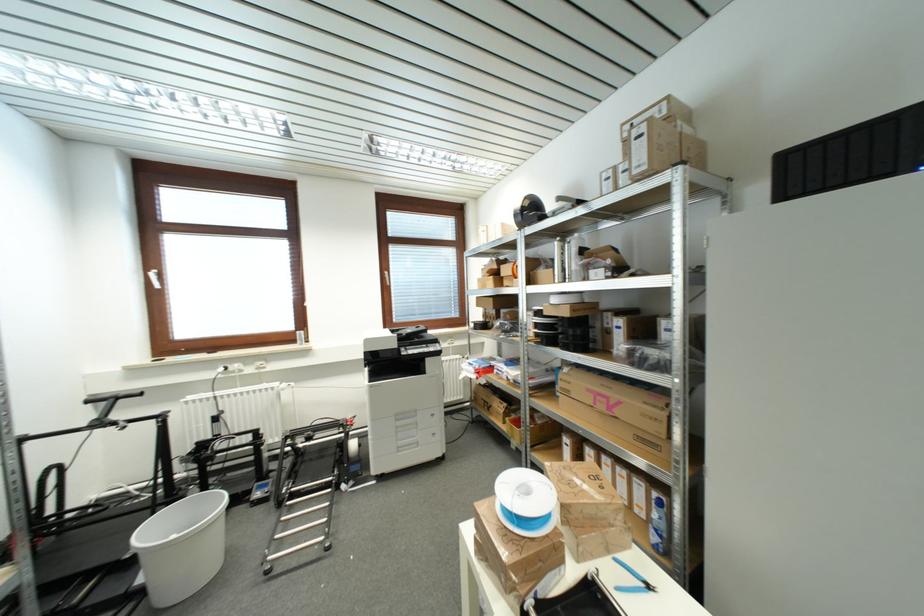
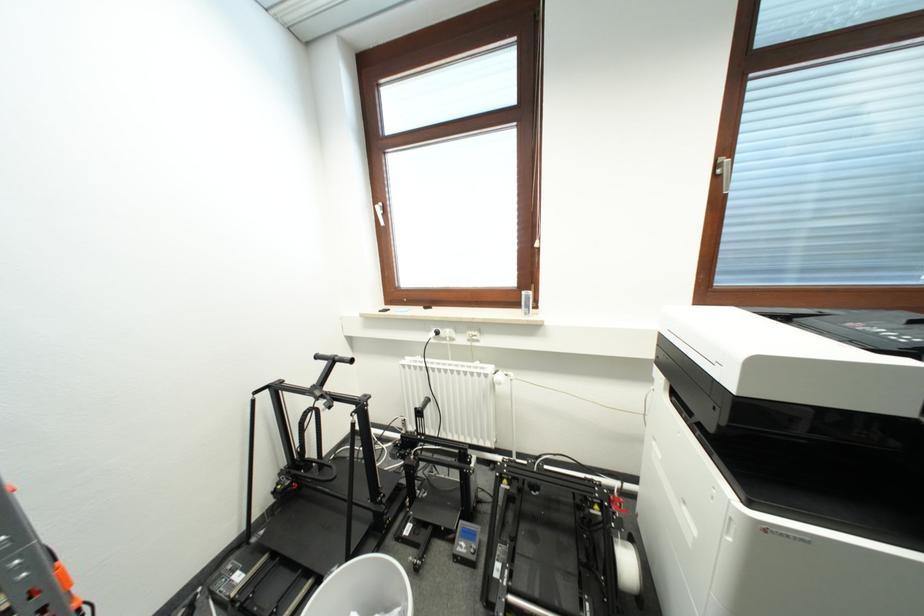
In the second image, find the point that corresponds to point 92,403 in the first image.

(322, 360)